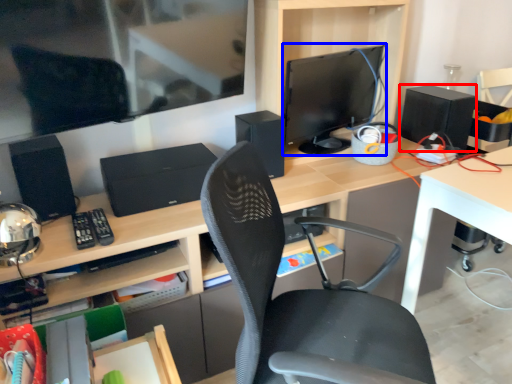
Question: Among these objects, which one is nearest to the camera, speaker (highlighted by a red box) or computer monitor (highlighted by a blue box)?

Choices:
 (A) speaker
 (B) computer monitor

Answer: (B)